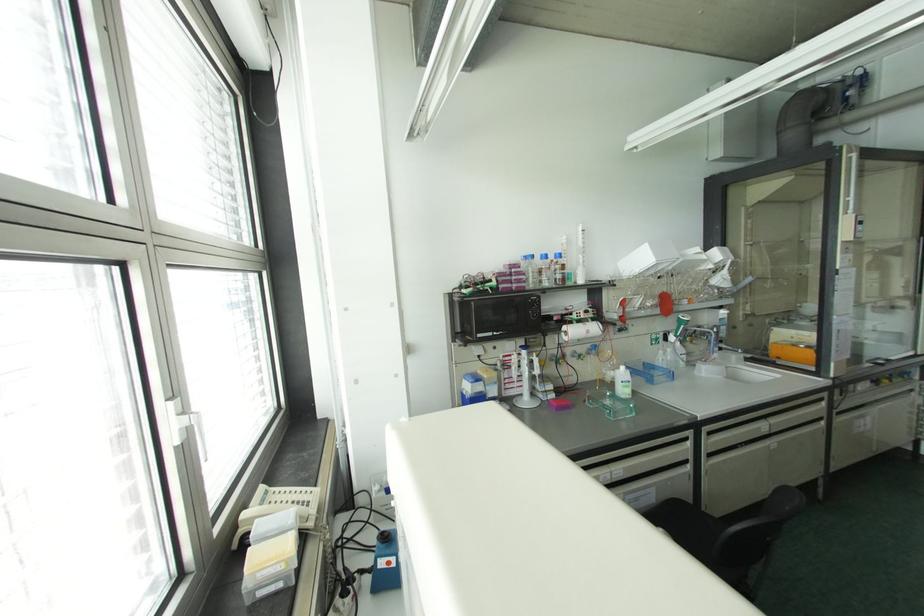
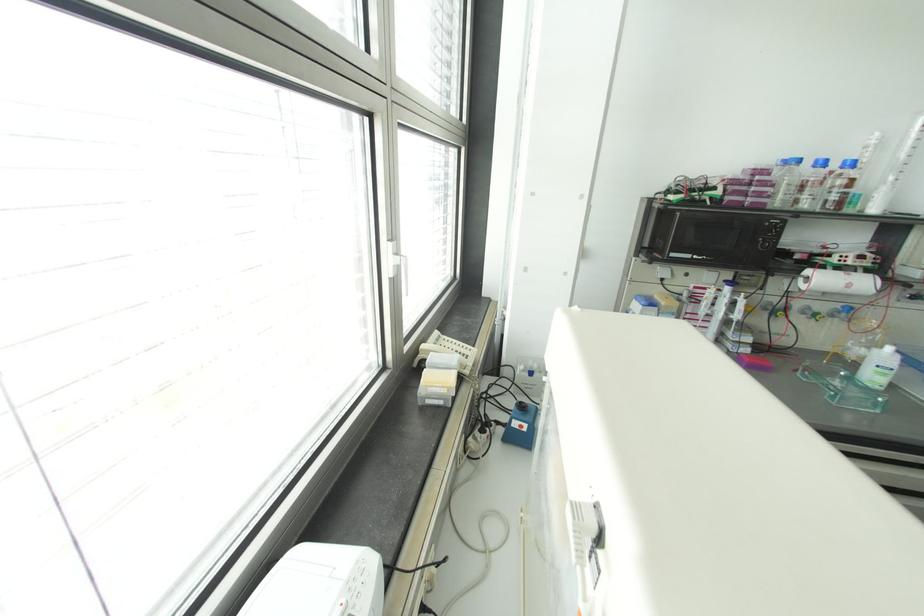
The point at (531, 256) is marked in the first image. Where is the corresponding point in the second image?

(797, 160)